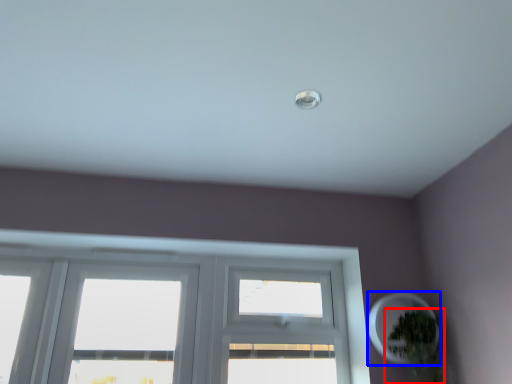
Question: Which object is further to the camera taking this photo, houseplant (highlighted by a red box) or oval (highlighted by a blue box)?

Choices:
 (A) houseplant
 (B) oval

Answer: (B)